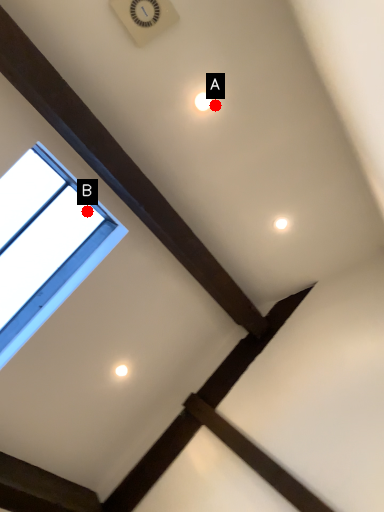
Question: Two points are circled on the image, labeled by A and B beside each circle. Which point is further to the camera?

Choices:
 (A) A is further
 (B) B is further

Answer: (B)